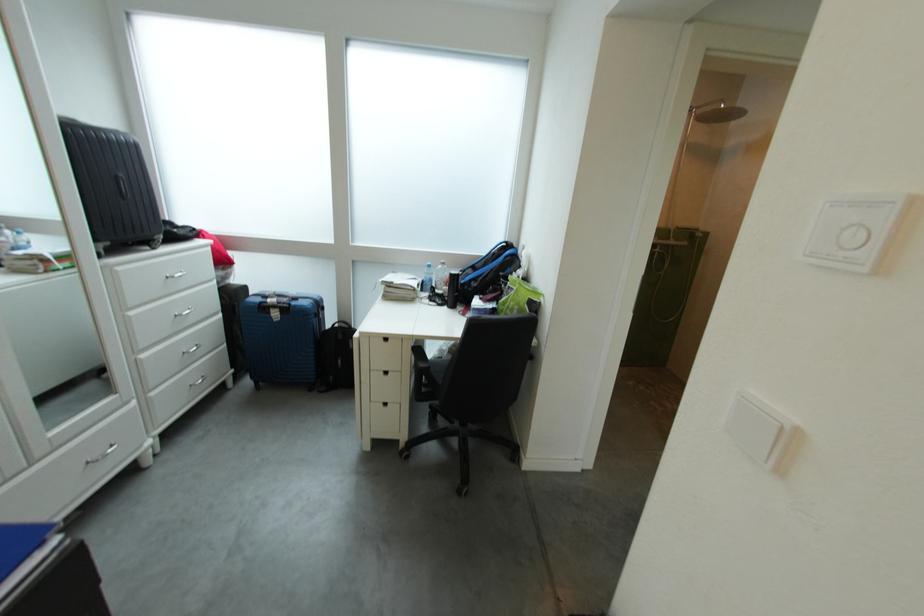
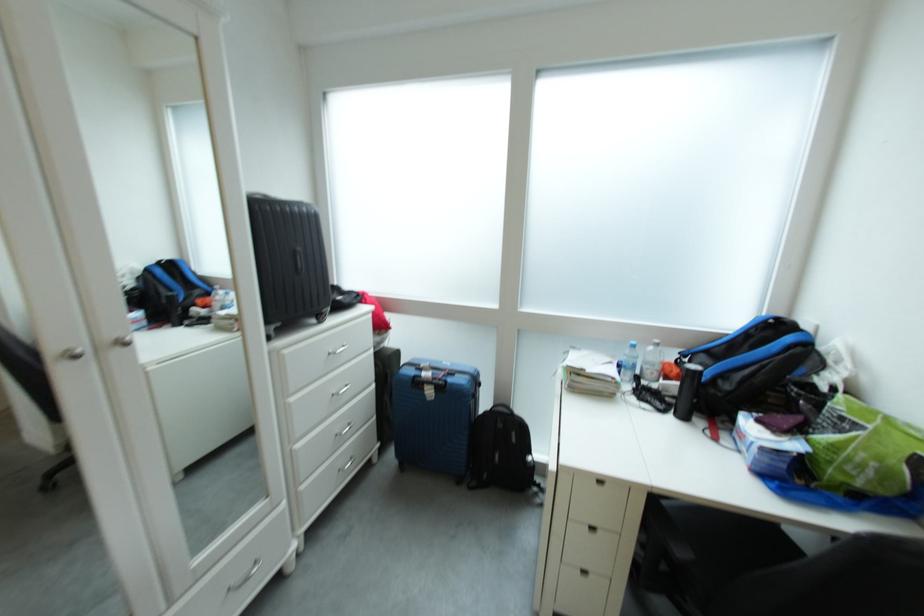
Question: How did the camera likely rotate?

Choices:
 (A) Left
 (B) Right
 (C) Up
 (D) Down

Answer: (A)